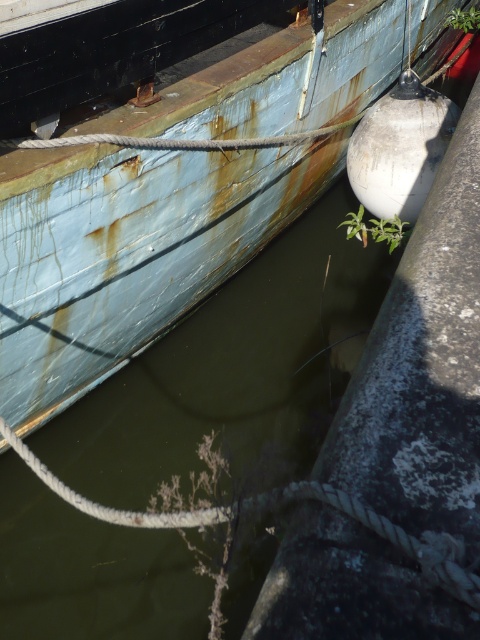
You are standing at the center of the image. Which direction should you move to reach the rusty metal boat at upper left?

You should move to the left and upwards to reach the rusty metal boat at upper left since it is located at point (128, 252), which is to the left and above the center of the image.

You are standing on the dock and see the green murky water at center and the green leafy plant at upper right. Which object is closer to the waterline?

The green murky water at center is much taller than the green leafy plant at upper right, so the green leafy plant at upper right is closer to the waterline.

You are standing on the boat dock and see two points marked on the water surface. The first point is at coordinates point (160, 339) and the second is at point (448, 20). Which point is closer to you?

Point point (160, 339) is in front of point point (448, 20), so it is closer to you.